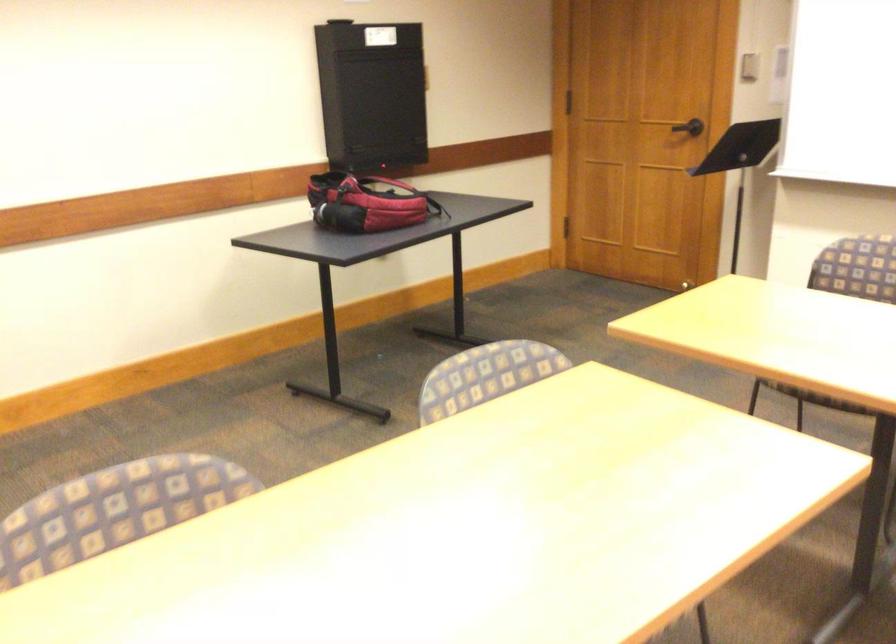
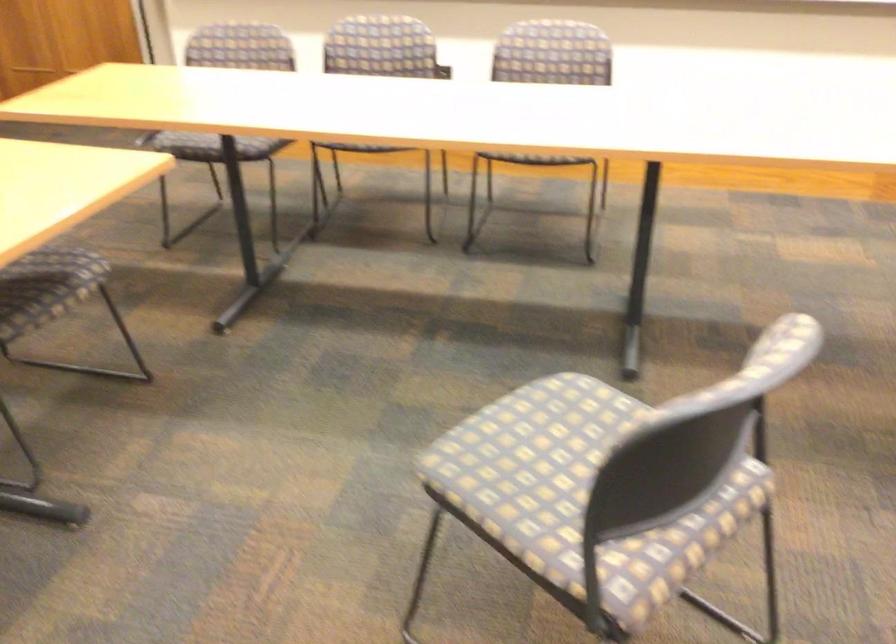
Question: How did the camera likely rotate?

Choices:
 (A) Left
 (B) Right
 (C) Up
 (D) Down

Answer: (B)